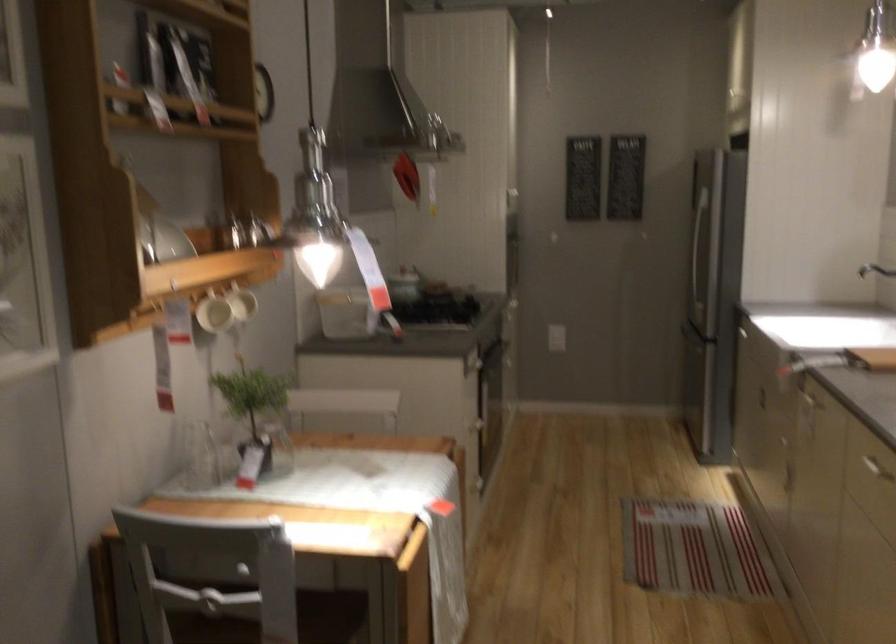
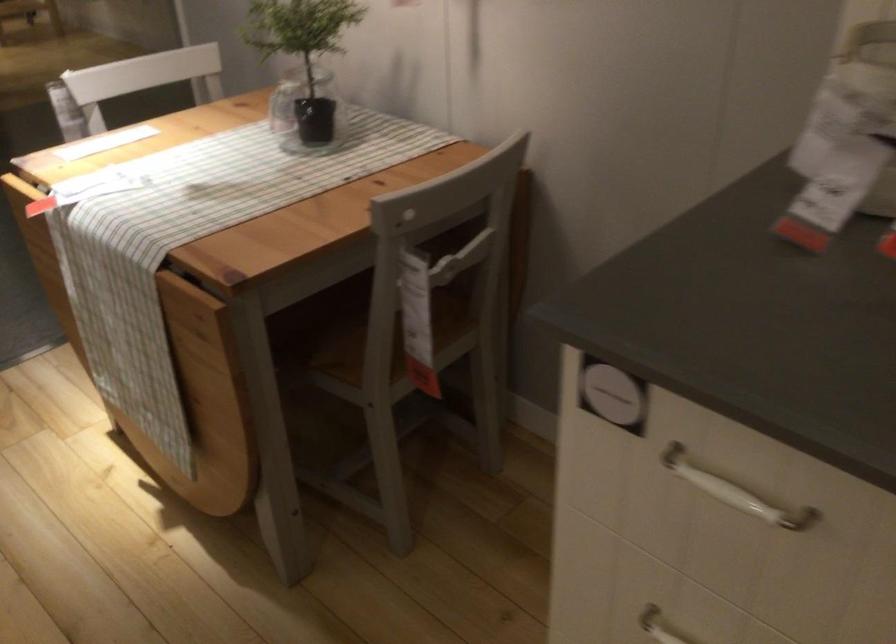
The point at (483, 364) is marked in the first image. Where is the corresponding point in the second image?

(734, 491)